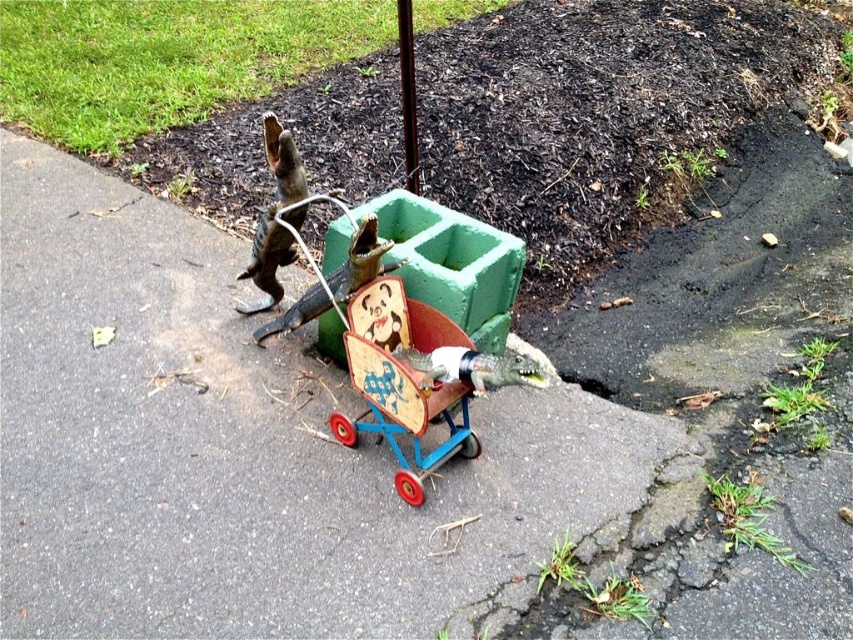
Does smooth asphalt pavement at center have a greater height compared to wooden toy cart at center?

Yes.

Can you confirm if smooth asphalt pavement at center is wider than wooden toy cart at center?

Yes, smooth asphalt pavement at center is wider than wooden toy cart at center.

Is point (15, 332) positioned after point (415, 384)?

Yes, point (15, 332) is behind point (415, 384).

I want to click on smooth asphalt pavement at center, so click(244, 449).